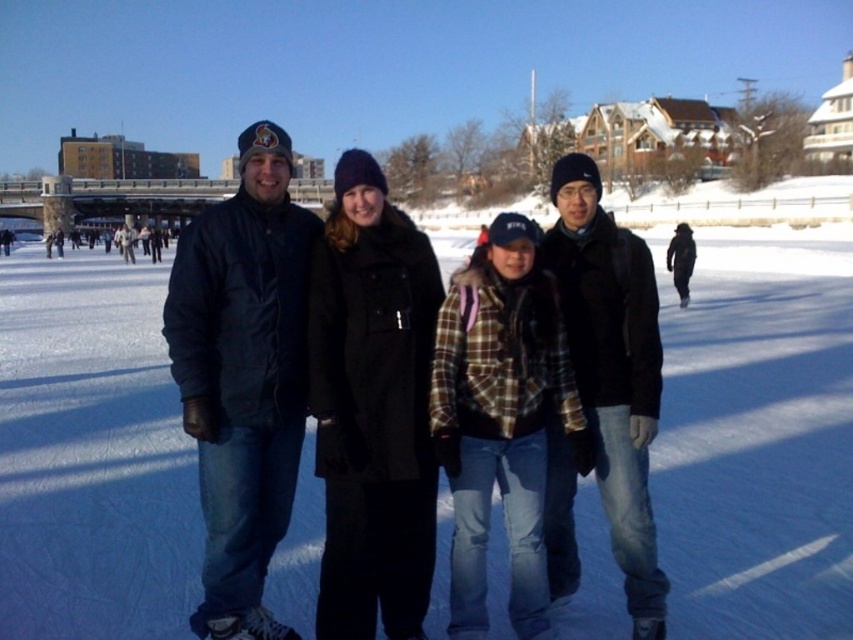
Question: Which object is positioned farthest from the matte black jacket at center?

Choices:
 (A) matte black jacket at left
 (B) dark blue jacket at left

Answer: (B)

Question: Does dark blue jacket at center have a greater width compared to matte black jacket at left?

Choices:
 (A) yes
 (B) no

Answer: (B)

Question: Does matte black jacket at center have a larger size compared to dark blue jacket at center?

Choices:
 (A) no
 (B) yes

Answer: (B)

Question: Is dark blue jacket at left to the left of matte black jacket at center from the viewer's perspective?

Choices:
 (A) yes
 (B) no

Answer: (B)

Question: Which object is positioned farthest from the matte black jacket at center?

Choices:
 (A) dark blue jacket at center
 (B) matte black jacket at left

Answer: (A)

Question: Which of the following is the closest to the observer?

Choices:
 (A) (207, 260)
 (B) (569, 339)
 (C) (257, 497)

Answer: (C)